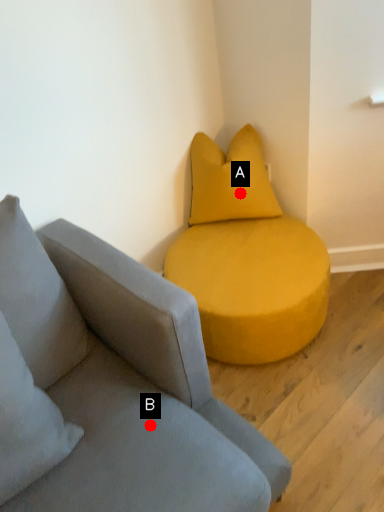
Question: Two points are circled on the image, labeled by A and B beside each circle. Which of the following is the closest to the observer?

Choices:
 (A) A is closer
 (B) B is closer

Answer: (B)